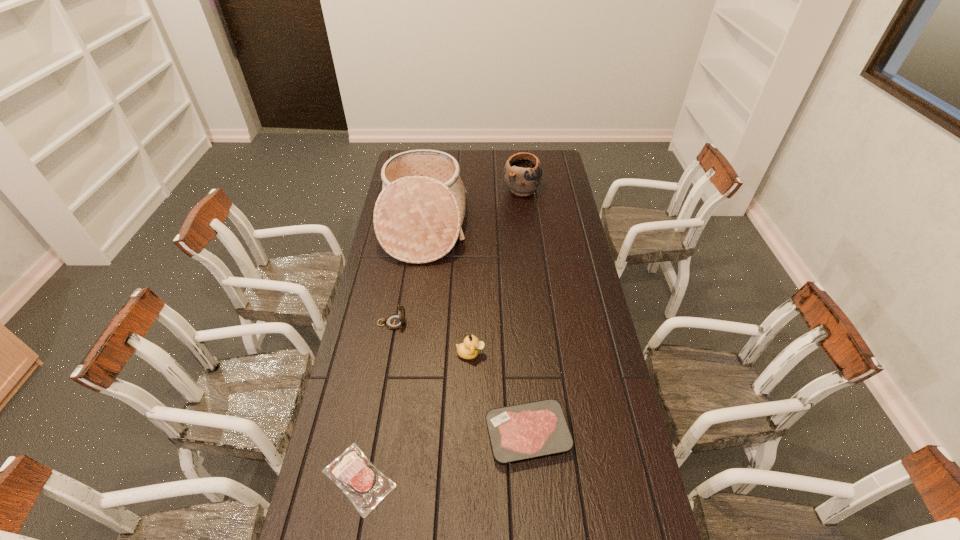
Identify the location of the tallest object. (418, 216).

Locate an element on the screen. This screenshot has width=960, height=540. the fifth shortest object is located at coordinates (522, 173).

At what (x,y) coordinates should I click in order to perform the action: click on compass. Please return your answer as a coordinate pair (x, y). Looking at the image, I should click on (394, 321).

The height and width of the screenshot is (540, 960). I want to click on the third nearest object, so click(469, 349).

Where is `the taller steak`? The image size is (960, 540). the taller steak is located at coordinates (528, 430).

Identify the location of the right steak. This screenshot has width=960, height=540. (528, 430).

I want to click on the left steak, so click(x=365, y=486).

In order to click on the shortest object in this screenshot , I will do `click(365, 486)`.

This screenshot has height=540, width=960. What are the coordinates of `free space located with the lid open on the tallest object` in the screenshot? It's located at (527, 226).

You are a GUI agent. You are given a task and a screenshot of the screen. Output one action in this format:
    pyautogui.click(x=<x>, y=<y>)
    Task: Click on the blank space located 0.240m on the left of the second tallest object
    The width and height of the screenshot is (960, 540).
    Given the screenshot: What is the action you would take?
    pyautogui.click(x=455, y=190)